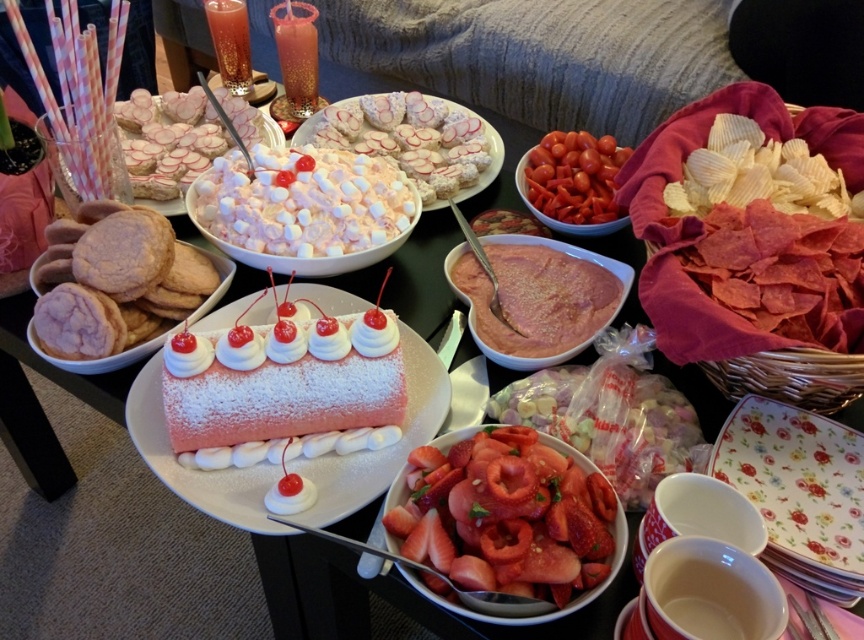
Is powdered sugar cookies at center wider than translucent glass beverage at upper left?

Yes, powdered sugar cookies at center is wider than translucent glass beverage at upper left.

What do you see at coordinates (415, 140) in the screenshot?
I see `powdered sugar cookies at center` at bounding box center [415, 140].

Does point (488, 140) come farther from viewer compared to point (224, 38)?

No.

The image size is (864, 640). I want to click on powdered sugar cookies at center, so click(415, 140).

Is white fluffy dessert at center wider than translucent glass beverage at upper left?

Yes.

Is white fluffy dessert at center bigger than translucent glass beverage at upper left?

Yes.

Does point (300, 243) come farther from viewer compared to point (242, 80)?

No, (300, 243) is in front of (242, 80).

The image size is (864, 640). What are the coordinates of `white fluffy dessert at center` in the screenshot? It's located at (303, 202).

Find the location of a particular element. The height and width of the screenshot is (640, 864). pink powdered cake at center is located at coordinates (283, 380).

The width and height of the screenshot is (864, 640). What do you see at coordinates (283, 380) in the screenshot?
I see `pink powdered cake at center` at bounding box center [283, 380].

This screenshot has height=640, width=864. What do you see at coordinates (283, 380) in the screenshot? I see `pink powdered cake at center` at bounding box center [283, 380].

The width and height of the screenshot is (864, 640). What are the coordinates of `pink powdered cake at center` in the screenshot? It's located at (283, 380).